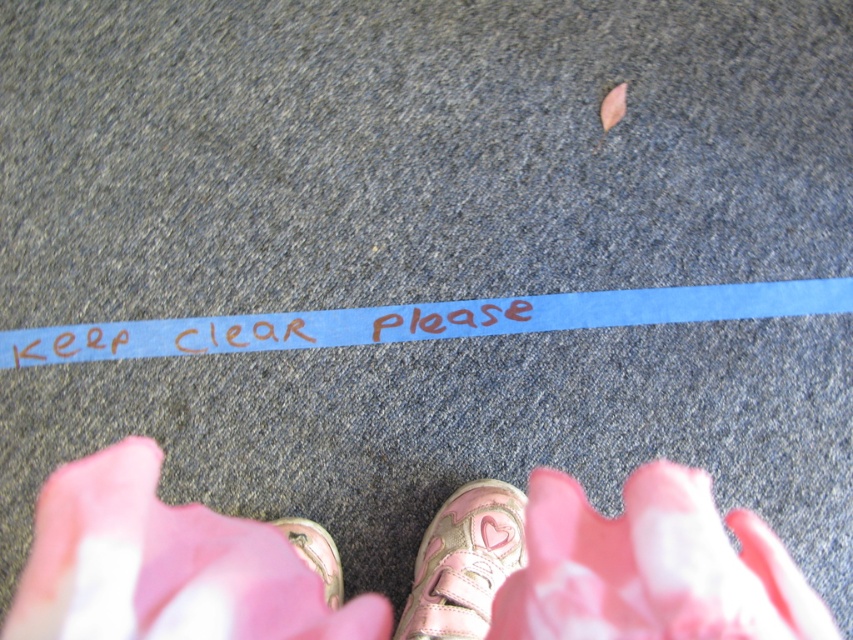
You are a pedestrian trying to walk through the parking lot. You see the pink glittery sneaker at lower center and the metallic pink shoe at lower center. Which one is on the right side when facing the parking lot?

The pink glittery sneaker at lower center is positioned on the right side of metallic pink shoe at lower center, so when facing the parking lot, the pink glittery sneaker at lower center is on the right side.

You are standing in the parking lot and see the blue paper strip at center and the metallic pink shoe at lower center. Which object is located to the right of the other?

The blue paper strip at center is to the right of the metallic pink shoe at lower center.

You are a delivery person who needs to place a package on the asphalt surface. The blue paper strip at center and the pink glittery sneaker at lower center are already there. Which object takes up more space horizontally?

The pink glittery sneaker at lower center takes up more space horizontally than the blue paper strip at center because the blue paper strip at center is shorter than the pink glittery sneaker at lower center.